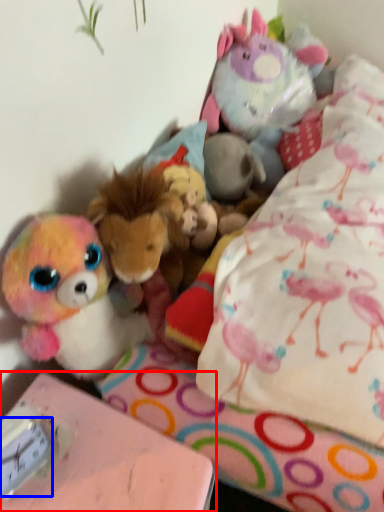
Question: Which object is closer to the camera taking this photo, table (highlighted by a red box) or clock (highlighted by a blue box)?

Choices:
 (A) table
 (B) clock

Answer: (A)